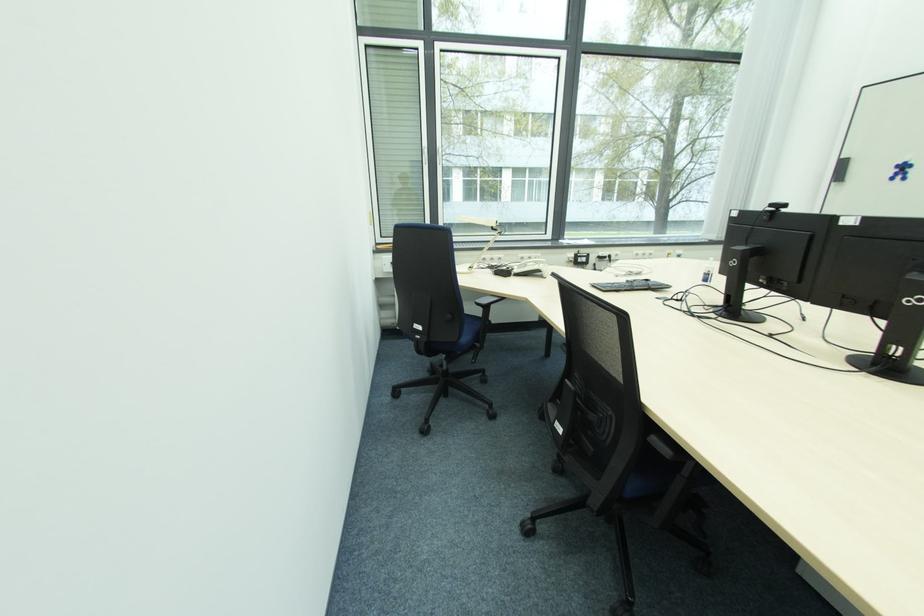
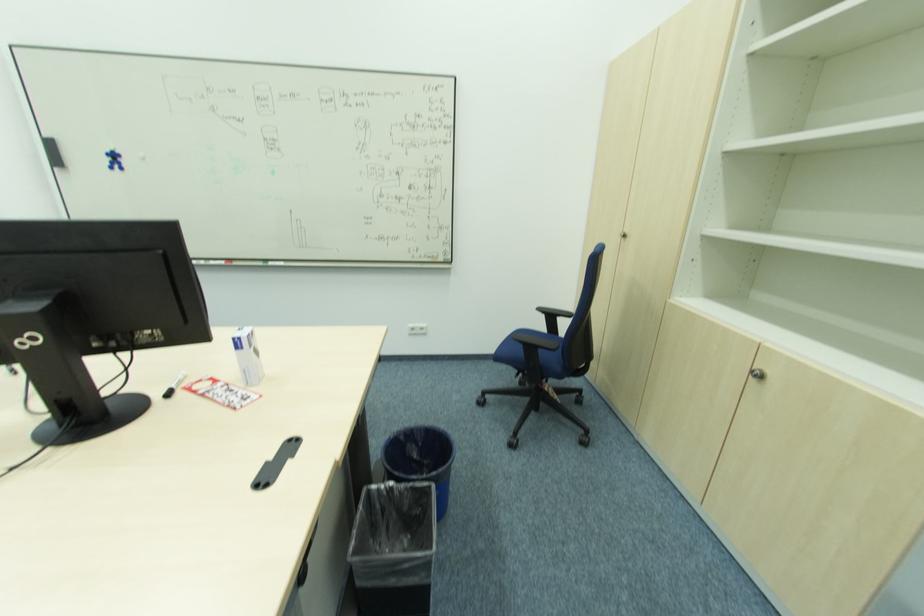
Based on the continuous images, in which direction is the camera rotating?

The camera rotated toward right-down.